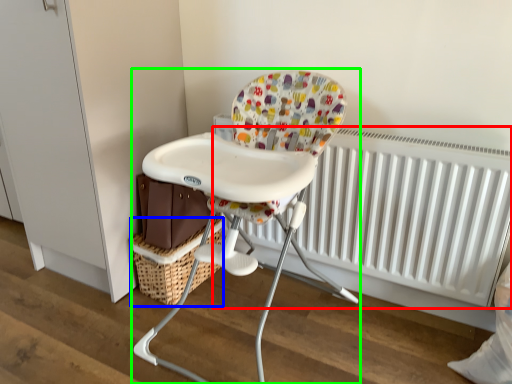
Question: Which object is the closest to the radiator (highlighted by a red box)? Choose among these: basket (highlighted by a blue box) or chair (highlighted by a green box).

Choices:
 (A) basket
 (B) chair

Answer: (B)